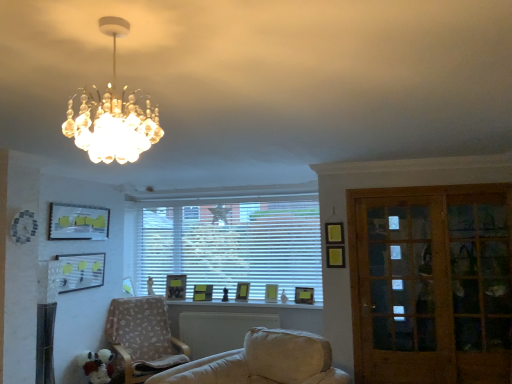
Locate an element on the screen. Image resolution: width=512 pixels, height=384 pixels. matte yellow picture frame at upper left, placed as the seventh picture frame when sorted from right to left is located at coordinates (78, 222).

Where is `matte black picture frame at center, which is the 4th picture frame from right to left`? This screenshot has width=512, height=384. matte black picture frame at center, which is the 4th picture frame from right to left is located at coordinates (202, 292).

Where is `matte black picture frame at center, marked as the 5th picture frame in a right-to-left arrangement`? matte black picture frame at center, marked as the 5th picture frame in a right-to-left arrangement is located at coordinates (176, 287).

What is the approximate width of crystal chandelier at upper left?

crystal chandelier at upper left is 16.61 inches wide.

How much space does matte yellow picture frame at left, positioned as the 6th picture frame in right-to-left order, occupy horizontally?

matte yellow picture frame at left, positioned as the 6th picture frame in right-to-left order, is 7.22 centimeters wide.

Consider the image. Measure the distance between point (238, 296) and camera.

→ Point (238, 296) is 5.14 meters away from camera.

This screenshot has height=384, width=512. Describe the element at coordinates (242, 291) in the screenshot. I see `matte black picture frame at window, the 5th picture frame from the left` at that location.

This screenshot has height=384, width=512. I want to click on white blinds at center, so click(x=230, y=238).

The width and height of the screenshot is (512, 384). Identify the location of matte yellow picture frame at upper left, placed as the seventh picture frame when sorted from right to left. (78, 222).

In order to click on lamp that appears in front of the matte black picture frame at window, the 5th picture frame from the left in this screenshot , I will do `click(113, 115)`.

Which point is more distant from viewer, (98,135) or (242,296)?

The point (242,296) is farther.

From the image's perspective, does crystal chandelier at upper left appear lower than matte black picture frame at window, which is the third picture frame in right-to-left order?

No, from the image's perspective, crystal chandelier at upper left is not below matte black picture frame at window, which is the third picture frame in right-to-left order.

Is crystal chandelier at upper left facing towards matte black picture frame at window, the 5th picture frame from the left?

No, crystal chandelier at upper left is not aimed at matte black picture frame at window, the 5th picture frame from the left.

Is matte yellow picture frame at window, placed as the 7th picture frame when sorted from left to right, at the right side of white glossy window sill at center?

Yes, matte yellow picture frame at window, placed as the 7th picture frame when sorted from left to right, is to the right of white glossy window sill at center.

Does matte yellow picture frame at window, placed as the 7th picture frame when sorted from left to right, have a lesser width compared to white glossy window sill at center?

Yes.

Considering the sizes of matte yellow picture frame at window, placed as the 7th picture frame when sorted from left to right, and white glossy window sill at center in the image, is matte yellow picture frame at window, placed as the 7th picture frame when sorted from left to right, bigger or smaller than white glossy window sill at center?

matte yellow picture frame at window, placed as the 7th picture frame when sorted from left to right, is smaller than white glossy window sill at center.

From a real-world perspective, between matte yellow picture frame at window, which is the 1th picture frame in right-to-left order, and white glossy window sill at center, who is vertically lower?

white glossy window sill at center.

Which object is closer to the camera, matte black picture frame at window, which is the third picture frame in right-to-left order, or beige fabric chair at lower left?

beige fabric chair at lower left is in front.

Which object is thinner, matte black picture frame at window, the 5th picture frame from the left, or beige fabric chair at lower left?

Thinner between the two is matte black picture frame at window, the 5th picture frame from the left.

Starting from the beige fabric chair at lower left, which picture frame is the 3rd one behind? Please provide its 2D coordinates.

[(242, 291)]

Which is correct: matte yellow picture frame at left, positioned as the 6th picture frame in right-to-left order, is inside matte yellow picture frame at center, acting as the 6th picture frame starting from the left, or outside of it?

matte yellow picture frame at left, positioned as the 6th picture frame in right-to-left order, is located beyond the bounds of matte yellow picture frame at center, acting as the 6th picture frame starting from the left.

Does matte yellow picture frame at left, placed as the second picture frame when sorted from left to right, have a greater height compared to matte yellow picture frame at center, which is counted as the second picture frame, starting from the right?

Indeed, matte yellow picture frame at left, placed as the second picture frame when sorted from left to right, has a greater height compared to matte yellow picture frame at center, which is counted as the second picture frame, starting from the right.

What are the coordinates of `picture frame that is the 4th one below the matte yellow picture frame at left, placed as the second picture frame when sorted from left to right (from a real-world perspective)` in the screenshot? It's located at (271, 293).

From the picture: Which object is wider, matte yellow picture frame at left, positioned as the 6th picture frame in right-to-left order, or matte yellow picture frame at center, acting as the 6th picture frame starting from the left?

matte yellow picture frame at center, acting as the 6th picture frame starting from the left, is wider.

Is white blinds at center completely or partially outside of matte black picture frame at center, which is the 4th picture frame from right to left?

Yes, white blinds at center is outside of matte black picture frame at center, which is the 4th picture frame from right to left.

Find the location of a particular element. The image size is (512, 384). picture frame that is the 3rd object located behind the white blinds at center is located at coordinates (202, 292).

Is white blinds at center facing away from matte black picture frame at center, which is the 4th picture frame from right to left?

Absolutely, white blinds at center is directed away from matte black picture frame at center, which is the 4th picture frame from right to left.

Between matte yellow picture frame at left, placed as the second picture frame when sorted from left to right, and white blinds at center, which one has smaller width?

white blinds at center.

Considering the relative sizes of matte yellow picture frame at left, positioned as the 6th picture frame in right-to-left order, and white blinds at center in the image provided, is matte yellow picture frame at left, positioned as the 6th picture frame in right-to-left order, bigger than white blinds at center?

Actually, matte yellow picture frame at left, positioned as the 6th picture frame in right-to-left order, might be smaller than white blinds at center.

How distant is matte yellow picture frame at left, placed as the second picture frame when sorted from left to right, from white blinds at center?

1.39 meters.

How many degrees apart are the facing directions of matte yellow picture frame at left, placed as the second picture frame when sorted from left to right, and white blinds at center?

matte yellow picture frame at left, placed as the second picture frame when sorted from left to right, and white blinds at center are facing 91.7 degrees away from each other.

From the image's perspective, between white blinds at center and matte yellow picture frame at upper left, placed as the seventh picture frame when sorted from right to left, who is located below?

white blinds at center is shown below in the image.

Is white blinds at center facing away from matte yellow picture frame at upper left, the first picture frame positioned from the left?

No, white blinds at center is not facing away from matte yellow picture frame at upper left, the first picture frame positioned from the left.

Between white blinds at center and matte yellow picture frame at upper left, the first picture frame positioned from the left, which one has larger size?

white blinds at center is bigger.

Is white blinds at center further to camera compared to matte yellow picture frame at upper left, placed as the seventh picture frame when sorted from right to left?

Yes.

This screenshot has height=384, width=512. In the image, there is a matte black picture frame at window, the 5th picture frame from the left. Find the location of `lamp above it (from the image's perspective)`. lamp above it (from the image's perspective) is located at coordinates (113, 115).

Which picture frame is the 3rd one when counting from the right side of the white glossy window sill at center? Please provide its 2D coordinates.

[(304, 295)]

When comparing their distances from matte yellow picture frame at window, which is the 1th picture frame in right-to-left order, does matte black picture frame at window, which is the third picture frame in right-to-left order, or white glossy window sill at center seem further?

matte black picture frame at window, which is the third picture frame in right-to-left order, is further to matte yellow picture frame at window, which is the 1th picture frame in right-to-left order.

From the picture: Considering their positions, is white glossy window sill at center positioned closer to matte yellow picture frame at center, acting as the 6th picture frame starting from the left, than wooden glass door at right?

white glossy window sill at center is closer to matte yellow picture frame at center, acting as the 6th picture frame starting from the left.

Based on their spatial positions, is matte yellow picture frame at upper left, the first picture frame positioned from the left, or matte black picture frame at center, the fourth picture frame from the left, closer to matte yellow picture frame at left, positioned as the 6th picture frame in right-to-left order?

Based on the image, matte yellow picture frame at upper left, the first picture frame positioned from the left, appears to be nearer to matte yellow picture frame at left, positioned as the 6th picture frame in right-to-left order.

Which object lies further to the anchor point white blinds at center, white glossy window sill at center or matte black picture frame at center, marked as the 5th picture frame in a right-to-left arrangement?

matte black picture frame at center, marked as the 5th picture frame in a right-to-left arrangement.

Considering their positions, is wooden glass door at right positioned further to matte black picture frame at center, the fourth picture frame from the left, than white glossy window sill at center?

The object further to matte black picture frame at center, the fourth picture frame from the left, is wooden glass door at right.

Which object lies further to the anchor point white blinds at center, white glossy window sill at center or wooden glass door at right?

wooden glass door at right is further to white blinds at center.

Which object lies nearer to the anchor point matte black picture frame at window, which is the third picture frame in right-to-left order, matte black picture frame at center, marked as the 5th picture frame in a right-to-left arrangement, or wooden glass door at right?

matte black picture frame at center, marked as the 5th picture frame in a right-to-left arrangement.

From the picture: From the image, which object appears to be nearer to matte yellow picture frame at upper left, the first picture frame positioned from the left, wooden glass door at right or white blinds at center?

The object closer to matte yellow picture frame at upper left, the first picture frame positioned from the left, is white blinds at center.

I want to click on window between matte yellow picture frame at left, positioned as the 6th picture frame in right-to-left order, and matte black picture frame at window, the 5th picture frame from the left, so click(230, 238).

This screenshot has height=384, width=512. I want to click on window sill located between matte yellow picture frame at left, positioned as the 6th picture frame in right-to-left order, and matte yellow picture frame at window, placed as the 7th picture frame when sorted from left to right, in the left-right direction, so click(238, 306).

You are a GUI agent. You are given a task and a screenshot of the screen. Output one action in this format:
    pyautogui.click(x=<x>, y=<y>)
    Task: Click on the chair positioned between matte yellow picture frame at upper left, placed as the seventh picture frame when sorted from right to left, and matte black picture frame at center, the fourth picture frame from the left, from near to far
    The width and height of the screenshot is (512, 384).
    Given the screenshot: What is the action you would take?
    pyautogui.click(x=143, y=337)

Image resolution: width=512 pixels, height=384 pixels. Identify the location of picture frame located between matte black picture frame at window, which is the third picture frame in right-to-left order, and matte yellow picture frame at window, which is the 1th picture frame in right-to-left order, in the left-right direction. (271, 293).